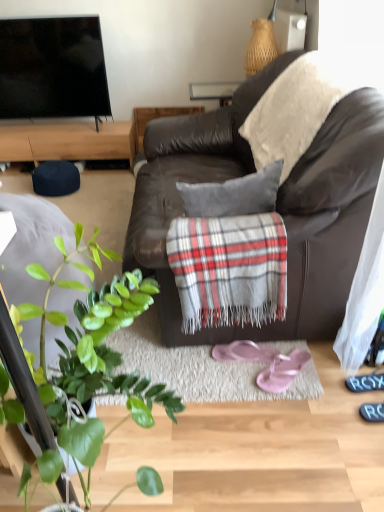
Find the location of a particular element. This screenshot has width=384, height=512. plaid woolen blanket at upper right is located at coordinates (294, 110).

In order to click on flat screen tv at upper left in this screenshot , I will do click(x=52, y=68).

How much space does pink fabric flip-flops at center, which is counted as the 1th footwear, starting from the left, occupy vertically?

pink fabric flip-flops at center, which is counted as the 1th footwear, starting from the left, is 1.77 inches in height.

What is the approximate width of wooden cabinet at upper left?

The width of wooden cabinet at upper left is 13.90 inches.

Locate an element on the screen. The height and width of the screenshot is (512, 384). plaid fabric at center is located at coordinates (229, 270).

Is plaid fabric at center not close to plaid woolen blanket at upper right?

No, there isn't a large distance between plaid fabric at center and plaid woolen blanket at upper right.

From a real-world perspective, between plaid fabric at center and plaid woolen blanket at upper right, who is vertically lower?

Result: In real-world perspective, plaid fabric at center is lower.

What are the coordinates of `blanket above the plaid fabric at center (from a real-world perspective)` in the screenshot? It's located at (294, 110).

Considering the sizes of plaid fabric at center and plaid woolen blanket at upper right in the image, is plaid fabric at center bigger or smaller than plaid woolen blanket at upper right?

Considering their sizes, plaid fabric at center takes up less space than plaid woolen blanket at upper right.

Is point (291, 373) closer or farther from the camera than point (29, 29)?

Point (291, 373) is positioned closer to the camera compared to point (29, 29).

Can you confirm if pink rubber flip-flops at lower center, positioned as the 1th footwear in right-to-left order, is shorter than flat screen tv at upper left?

Yes.

Where is `television above the pink rubber flip-flops at lower center, positioned as the 1th footwear in right-to-left order (from the image's perspective)`? television above the pink rubber flip-flops at lower center, positioned as the 1th footwear in right-to-left order (from the image's perspective) is located at coordinates (52, 68).

Considering the relative sizes of pink rubber flip-flops at lower center, the 2th footwear viewed from the left, and flat screen tv at upper left in the image provided, is pink rubber flip-flops at lower center, the 2th footwear viewed from the left, bigger than flat screen tv at upper left?

Incorrect, pink rubber flip-flops at lower center, the 2th footwear viewed from the left, is not larger than flat screen tv at upper left.

Is plaid woolen blanket at upper right oriented away from pink rubber flip-flops at lower center, the 2th footwear viewed from the left?

No.

Consider the image. Can we say plaid woolen blanket at upper right lies outside pink rubber flip-flops at lower center, the 2th footwear viewed from the left?

Absolutely, plaid woolen blanket at upper right is external to pink rubber flip-flops at lower center, the 2th footwear viewed from the left.

How different are the orientations of plaid woolen blanket at upper right and pink rubber flip-flops at lower center, positioned as the 1th footwear in right-to-left order, in degrees?

The angular difference between plaid woolen blanket at upper right and pink rubber flip-flops at lower center, positioned as the 1th footwear in right-to-left order, is 48.1 degrees.

From the image's perspective, is plaid woolen blanket at upper right over pink rubber flip-flops at lower center, the 2th footwear viewed from the left?

Indeed, from the image's perspective, plaid woolen blanket at upper right is shown above pink rubber flip-flops at lower center, the 2th footwear viewed from the left.

Does black rubber shoe at lower right contain wooden cabinet at upper left?

No, wooden cabinet at upper left is located outside of black rubber shoe at lower right.

In the scene shown: From the image's perspective, would you say black rubber shoe at lower right is shown under wooden cabinet at upper left?

Yes, from the image's perspective, black rubber shoe at lower right is below wooden cabinet at upper left.

Is wooden cabinet at upper left at the back of black rubber shoe at lower right?

No, black rubber shoe at lower right's orientation is not away from wooden cabinet at upper left.

Is black rubber shoe at lower right taller than wooden cabinet at upper left?

No.

Which is more to the left, black rubber shoe at lower right or brown leather couch at center?

From the viewer's perspective, brown leather couch at center appears more on the left side.

Is black rubber shoe at lower right oriented away from brown leather couch at center?

No.

Consider the image. Is brown leather couch at center surrounded by black rubber shoe at lower right?

No, brown leather couch at center is located outside of black rubber shoe at lower right.

Based on the photo, can you confirm if black rubber shoe at lower right is bigger than brown leather couch at center?

No.

From the picture: Which is more to the left, flat screen tv at upper left or pink rubber flip-flops at lower center, positioned as the 1th footwear in right-to-left order?

→ flat screen tv at upper left.

Would you say flat screen tv at upper left is outside pink rubber flip-flops at lower center, positioned as the 1th footwear in right-to-left order?

Yes, flat screen tv at upper left is outside of pink rubber flip-flops at lower center, positioned as the 1th footwear in right-to-left order.

From a real-world perspective, does flat screen tv at upper left sit lower than pink rubber flip-flops at lower center, positioned as the 1th footwear in right-to-left order?

No, from a real-world perspective, flat screen tv at upper left is not beneath pink rubber flip-flops at lower center, positioned as the 1th footwear in right-to-left order.

What's the angular difference between flat screen tv at upper left and pink rubber flip-flops at lower center, the 2th footwear viewed from the left,'s facing directions?

The angular difference between flat screen tv at upper left and pink rubber flip-flops at lower center, the 2th footwear viewed from the left, is 39.8 degrees.

Is wooden cabinet at upper left wider or thinner than flat screen tv at upper left?

Clearly, wooden cabinet at upper left has more width compared to flat screen tv at upper left.

From a real-world perspective, is wooden cabinet at upper left over flat screen tv at upper left?

Incorrect, from a real-world perspective, wooden cabinet at upper left is lower than flat screen tv at upper left.

From the image's perspective, is wooden cabinet at upper left above or below flat screen tv at upper left?

Based on their image positions, wooden cabinet at upper left is located beneath flat screen tv at upper left.

In terms of height, does wooden cabinet at upper left look taller or shorter compared to flat screen tv at upper left?

Clearly, wooden cabinet at upper left is shorter compared to flat screen tv at upper left.

The width and height of the screenshot is (384, 512). Find the location of `plaid that appears in front of the plaid woolen blanket at upper right`. plaid that appears in front of the plaid woolen blanket at upper right is located at coordinates (229, 270).

From a real-world perspective, starting from the flat screen tv at upper left, which footwear is the 2nd one below it? Please provide its 2D coordinates.

[(282, 371)]

Estimate the real-world distances between objects in this image. Which object is further from brown leather couch at center, pink rubber flip-flops at lower center, positioned as the 1th footwear in right-to-left order, or wooden cabinet at upper left?

wooden cabinet at upper left is positioned further to the anchor brown leather couch at center.

Looking at the image, which one is located further to brown leather couch at center, plaid woolen blanket at upper right or pink fabric flip-flops at center, which is counted as the 1th footwear, starting from the left?

pink fabric flip-flops at center, which is counted as the 1th footwear, starting from the left, is positioned further to the anchor brown leather couch at center.

Estimate the real-world distances between objects in this image. Which object is further from plaid fabric at center, black rubber shoe at lower right or green leafy plant at lower left?

black rubber shoe at lower right.

From the image, which object appears to be nearer to pink rubber flip-flops at lower center, the 2th footwear viewed from the left, pink fabric flip-flops at center, arranged as the second footwear when viewed from the right, or plaid fabric at center?

Among the two, pink fabric flip-flops at center, arranged as the second footwear when viewed from the right, is located nearer to pink rubber flip-flops at lower center, the 2th footwear viewed from the left.

From the image, which object appears to be farther from green leafy plant at lower left, pink fabric flip-flops at center, which is counted as the 1th footwear, starting from the left, or wooden cabinet at upper left?

Based on the image, wooden cabinet at upper left appears to be further to green leafy plant at lower left.

From the image, which object appears to be nearer to flat screen tv at upper left, pink rubber flip-flops at lower center, positioned as the 1th footwear in right-to-left order, or black rubber shoe at lower right?

The object closer to flat screen tv at upper left is pink rubber flip-flops at lower center, positioned as the 1th footwear in right-to-left order.

Estimate the real-world distances between objects in this image. Which object is further from plaid fabric at center, brown leather couch at center or pink fabric flip-flops at center, which is counted as the 1th footwear, starting from the left?

Among the two, pink fabric flip-flops at center, which is counted as the 1th footwear, starting from the left, is located further to plaid fabric at center.

Which object lies further to the anchor point black rubber shoe at lower right, plaid woolen blanket at upper right or brown leather couch at center?

plaid woolen blanket at upper right is further to black rubber shoe at lower right.

Find the location of `shoe positioned between green leafy plant at lower left and flat screen tv at upper left from near to far`. shoe positioned between green leafy plant at lower left and flat screen tv at upper left from near to far is located at coordinates (365, 383).

The height and width of the screenshot is (512, 384). Identify the location of plaid located between brown leather couch at center and wooden cabinet at upper left in the depth direction. (229, 270).

The height and width of the screenshot is (512, 384). I want to click on television positioned between plaid fabric at center and wooden cabinet at upper left from near to far, so click(52, 68).

You are a GUI agent. You are given a task and a screenshot of the screen. Output one action in this format:
    pyautogui.click(x=<x>, y=<y>)
    Task: Click on the plaid that lies between brown leather couch at center and pink rubber flip-flops at lower center, the 2th footwear viewed from the left, from top to bottom
    
    Given the screenshot: What is the action you would take?
    pyautogui.click(x=229, y=270)